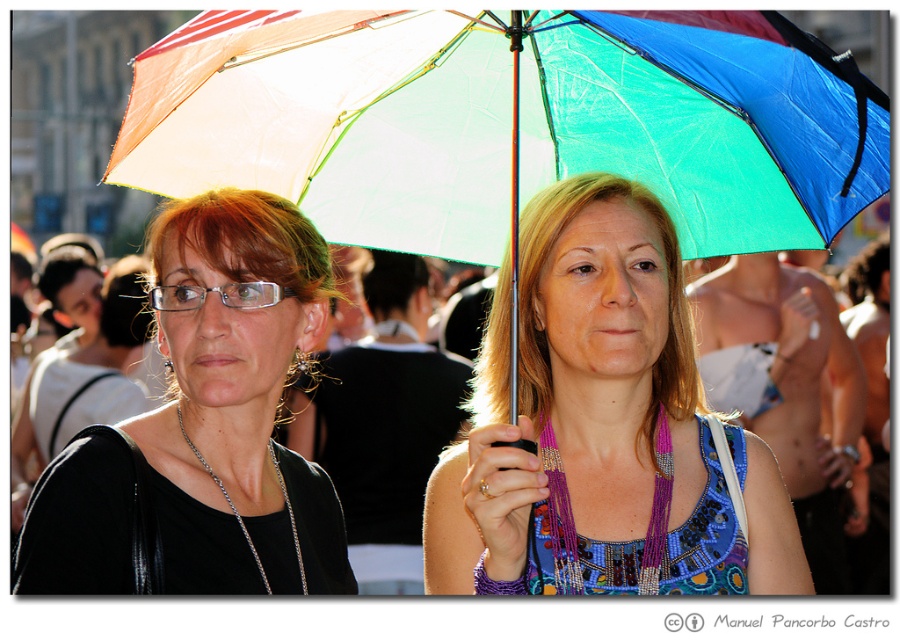
You are a photographer trying to capture a clear shot of the rainbow fabric umbrella at center and the multicolored fabric umbrella at center. Since both umbrellas are at the center, which one is bigger and will block the view of the other?

The rainbow fabric umbrella at center is larger in size compared to the multicolored fabric umbrella at center, so it will block the view of the multicolored fabric umbrella at center.

You are a photographer trying to capture a portrait of both women under the multicolored fabric umbrella at center and the matte black shirt at upper left. Given that the umbrella is taller than the shirt, will the umbrella fully cover both subjects from above?

The multicolored fabric umbrella at center is taller than the matte black shirt at upper left, so the umbrella can fully cover both subjects from above since it extends higher than the shirt.